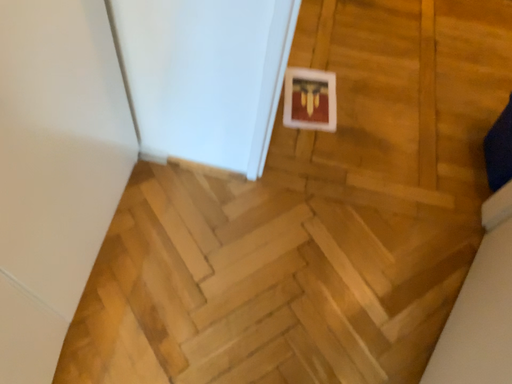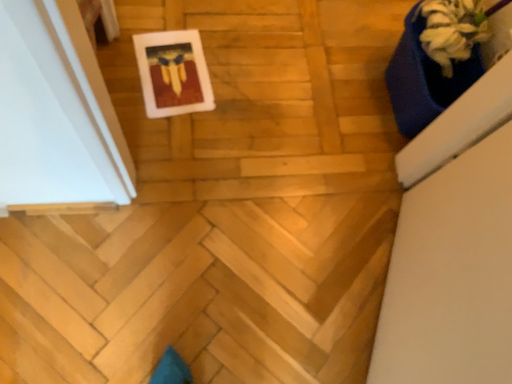
Question: Which way did the camera rotate in the video?

Choices:
 (A) rotated downward
 (B) rotated upward

Answer: (A)